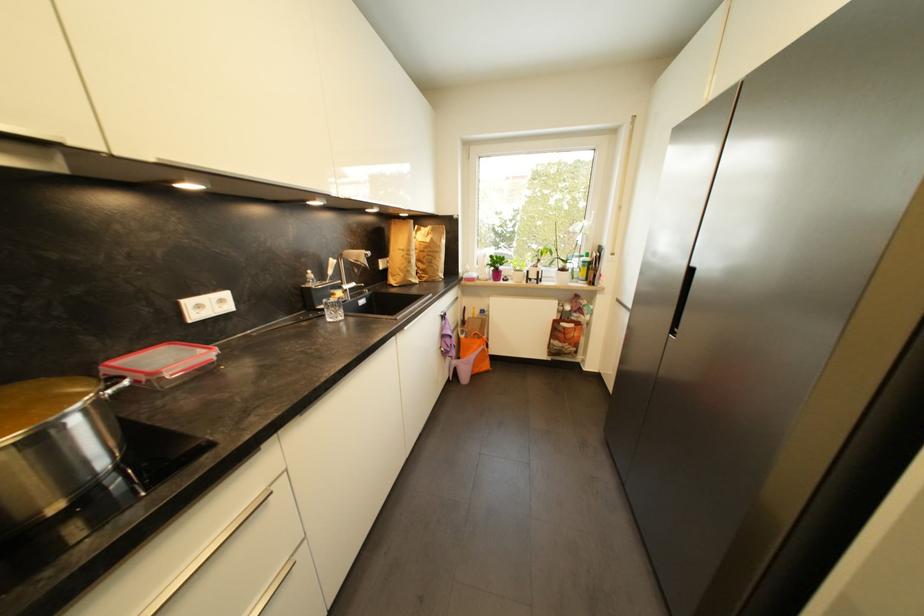
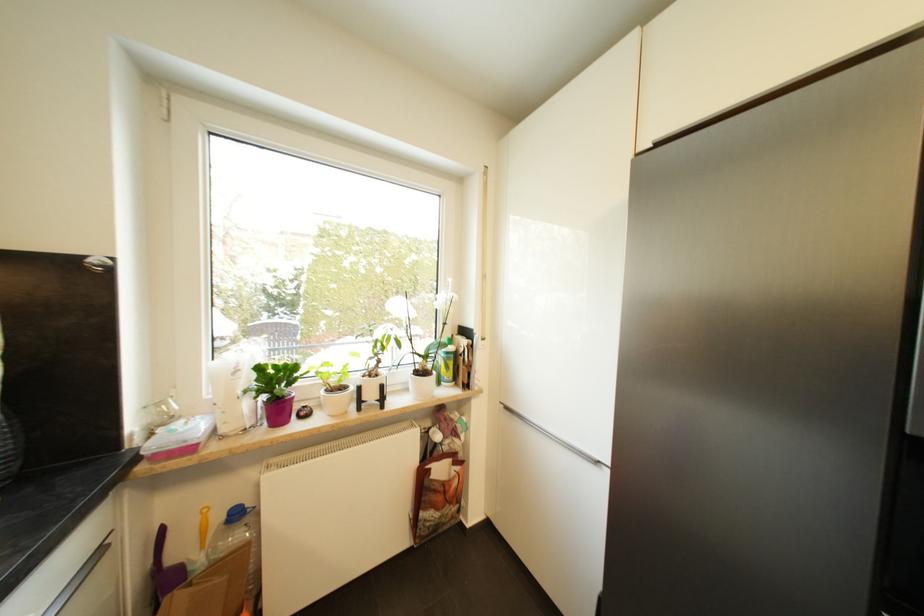
Find the pixel in the second image that matches [589,264] in the first image.

(453, 355)